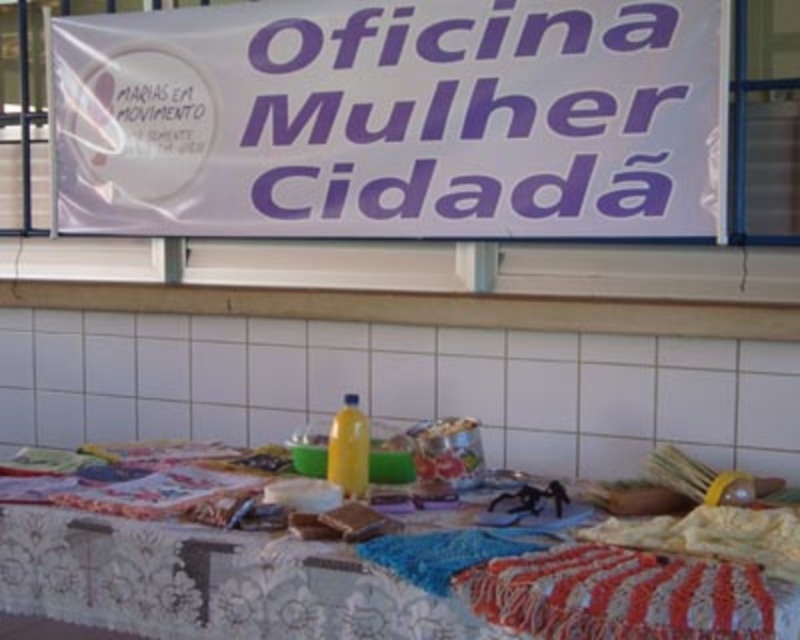
How far apart are white paper banner at upper center and textured fabric tablecloth at center?

white paper banner at upper center and textured fabric tablecloth at center are 4.46 feet apart from each other.

Is point (610, 140) farther from camera compared to point (332, 552)?

Yes, it is behind point (332, 552).

In order to click on white paper banner at upper center in this screenshot , I will do `click(393, 118)`.

Does point (18, 513) come behind point (602, 576)?

Yes, point (18, 513) is behind point (602, 576).

Is point (204, 625) less distant than point (764, 579)?

That is False.

At what (x,y) coordinates should I click in order to perform the action: click on textured fabric tablecloth at center. Please return your answer as a coordinate pair (x, y). This screenshot has height=640, width=800. Looking at the image, I should click on (210, 580).

Which is more to the right, white paper banner at upper center or striped crochet blanket at lower right?

striped crochet blanket at lower right

Where is `white paper banner at upper center`? The height and width of the screenshot is (640, 800). white paper banner at upper center is located at coordinates (393, 118).

Which is behind, point (280, 189) or point (624, 548)?

The point (280, 189) is behind.

Locate an element on the screen. The width and height of the screenshot is (800, 640). white paper banner at upper center is located at coordinates [393, 118].